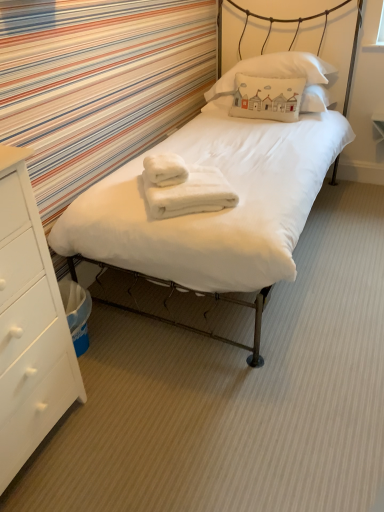
Find the location of `vacant region above white cotton pillow at center, arranged as the 2th pillow when viewed from the top (from a real-world perspective)`. vacant region above white cotton pillow at center, arranged as the 2th pillow when viewed from the top (from a real-world perspective) is located at coordinates (276, 67).